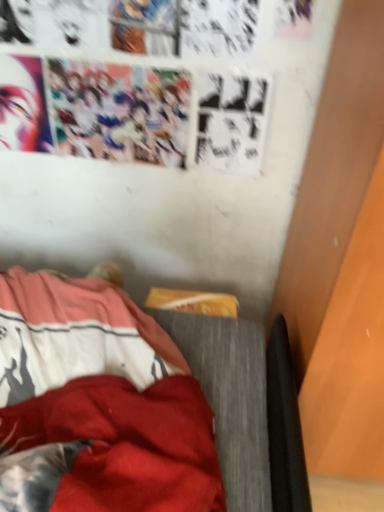
Question: Considering the positions of smooth matte face at upper left and wooden bed frame at lower left in the image, is smooth matte face at upper left wider or thinner than wooden bed frame at lower left?

Choices:
 (A) wide
 (B) thin

Answer: (B)

Question: From the image's perspective, relative to wooden bed frame at lower left, is smooth matte face at upper left above or below?

Choices:
 (A) below
 (B) above

Answer: (B)

Question: Is point (18, 62) positioned closer to the camera than point (39, 326)?

Choices:
 (A) farther
 (B) closer

Answer: (A)

Question: From a real-world perspective, relative to smooth matte face at upper left, is wooden bed frame at lower left vertically above or below?

Choices:
 (A) below
 (B) above

Answer: (A)

Question: Considering the positions of wooden bed frame at lower left and smooth matte face at upper left in the image, is wooden bed frame at lower left bigger or smaller than smooth matte face at upper left?

Choices:
 (A) small
 (B) big

Answer: (B)

Question: Is point (49, 347) closer or farther from the camera than point (16, 88)?

Choices:
 (A) closer
 (B) farther

Answer: (A)

Question: Is wooden bed frame at lower left in front of or behind smooth matte face at upper left in the image?

Choices:
 (A) behind
 (B) front

Answer: (B)